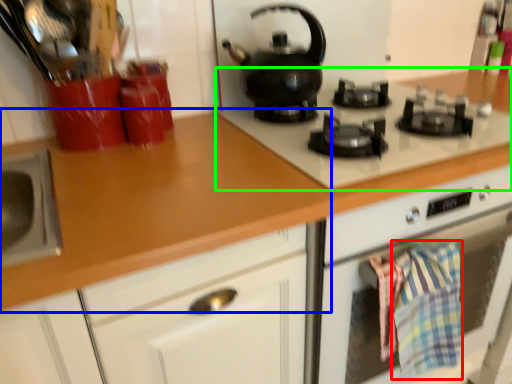
Question: Based on their relative distances, which object is nearer to blanket (highlighted by a red box)? Choose from countertop (highlighted by a blue box) and gas stove (highlighted by a green box).

Choices:
 (A) countertop
 (B) gas stove

Answer: (B)